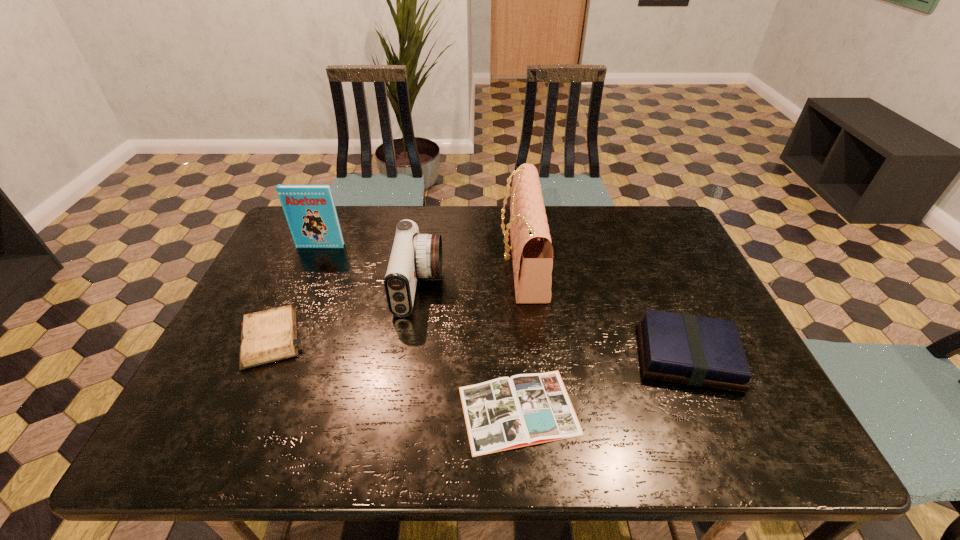
This screenshot has width=960, height=540. I want to click on free point located 0.140m on the front-facing side of the handbag, so click(453, 261).

Identify the location of vacant position located 0.120m on the front-facing side of the handbag. Image resolution: width=960 pixels, height=540 pixels. (460, 261).

This screenshot has height=540, width=960. I want to click on free location located 0.350m on the front-facing side of the handbag, so click(383, 261).

Where is `vacant space positioned on the front cover of the farthest book`? This screenshot has height=540, width=960. vacant space positioned on the front cover of the farthest book is located at coordinates click(x=287, y=323).

At what (x,y) coordinates should I click in order to perform the action: click on vacant space located 0.200m on the surface of the camcorder. Please return your answer as a coordinate pair (x, y). This screenshot has height=540, width=960. Looking at the image, I should click on (513, 287).

Identify the location of free location located on the left of the second shortest book. This screenshot has width=960, height=540. (496, 356).

You are a GUI agent. You are given a task and a screenshot of the screen. Output one action in this format:
    pyautogui.click(x=<x>, y=<y>)
    Task: Click on the blank area located on the front of the fifth tallest object
    Image resolution: width=960 pixels, height=540 pixels.
    Given the screenshot: What is the action you would take?
    pyautogui.click(x=236, y=414)

You are a GUI agent. You are given a task and a screenshot of the screen. Output one action in this format:
    pyautogui.click(x=<x>, y=<y>)
    Task: Click on the free space located 0.350m on the right of the shortest object
    This screenshot has height=540, width=960.
    Given the screenshot: What is the action you would take?
    pyautogui.click(x=743, y=410)

Where is `handbag present at the far edge`? Image resolution: width=960 pixels, height=540 pixels. handbag present at the far edge is located at coordinates (532, 252).

The image size is (960, 540). What are the coordinates of `book that is at the far edge` in the screenshot? It's located at (310, 211).